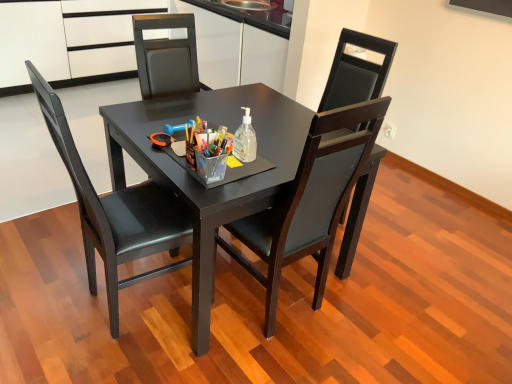
Question: Is point (x=268, y=140) closer or farther from the camera than point (x=115, y=228)?

Choices:
 (A) closer
 (B) farther

Answer: (B)

Question: Would you say matte black table at center is to the left or to the right of matte black chair at center, which ranks as the 1th chair in left-to-right order, in the picture?

Choices:
 (A) right
 (B) left

Answer: (A)

Question: Estimate the real-world distances between objects in this image. Which object is farther from the white matte cabinet at upper left?

Choices:
 (A) clear plastic bottle at center
 (B) matte black chair at center, placed as the 1th chair when sorted from right to left
 (C) matte black chair at center, which ranks as the 1th chair in left-to-right order
 (D) matte black table at center

Answer: (B)

Question: Estimate the real-world distances between objects in this image. Which object is farther from the clear plastic bottle at center?

Choices:
 (A) matte black chair at center, which ranks as the 1th chair in left-to-right order
 (B) matte black chair at center, placed as the 1th chair when sorted from right to left
 (C) white matte cabinet at upper left
 (D) matte black table at center

Answer: (C)